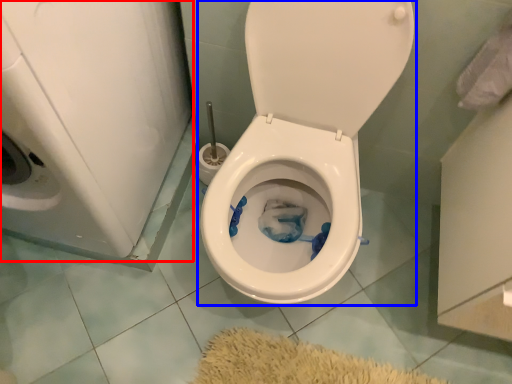
Question: Which object is closer to the camera taking this photo, washer (highlighted by a red box) or toilet (highlighted by a blue box)?

Choices:
 (A) washer
 (B) toilet

Answer: (A)